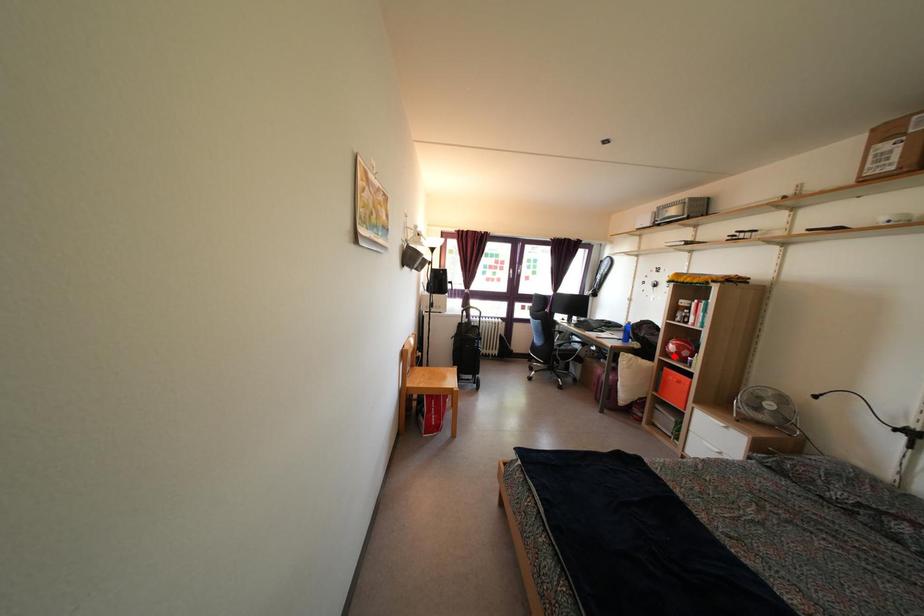
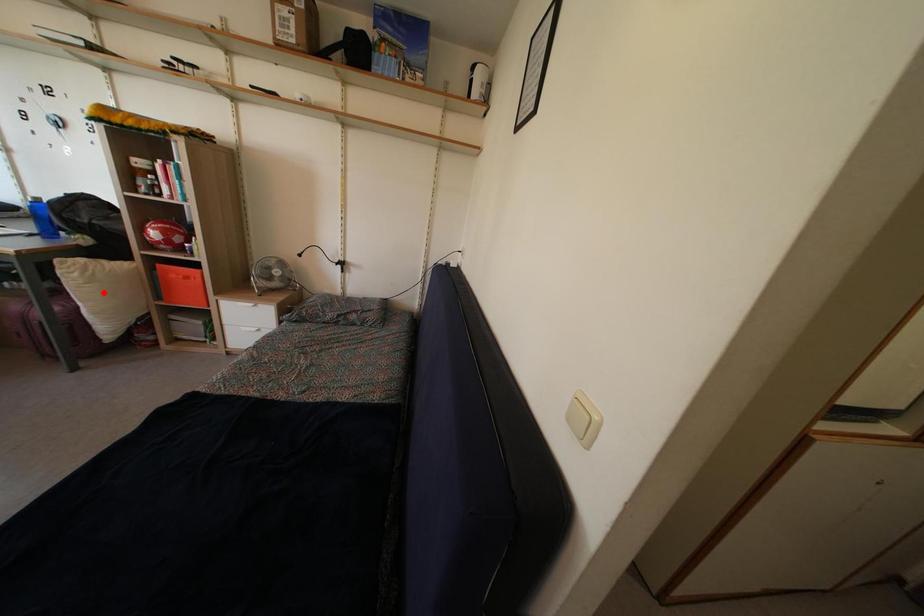
I am providing you with two images of the same scene from different viewpoints. A red point is marked on the first image and another point is marked on the second image. Is the marked point in image1 the same physical position as the marked point in image2?

No